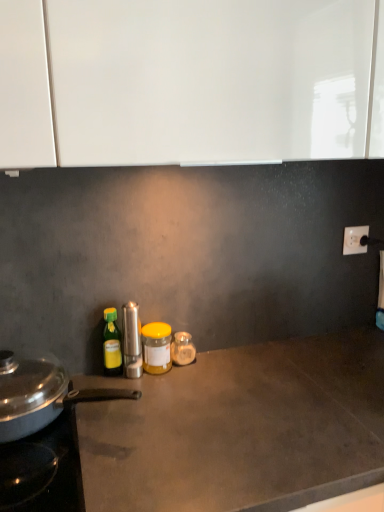
The width and height of the screenshot is (384, 512). I want to click on vacant area that lies between metallic silver pan at left, which appears as the first kitchen appliance when viewed from the left, and yellow matte jar at center, which ranks as the second bottle in left-to-right order, so click(154, 396).